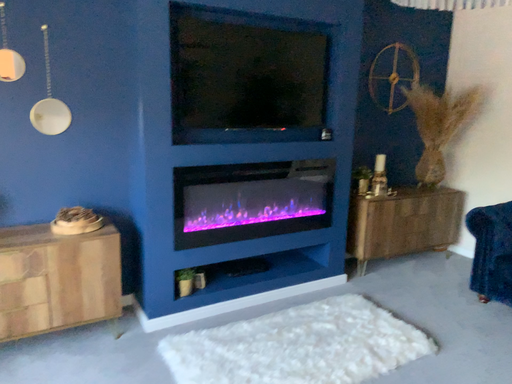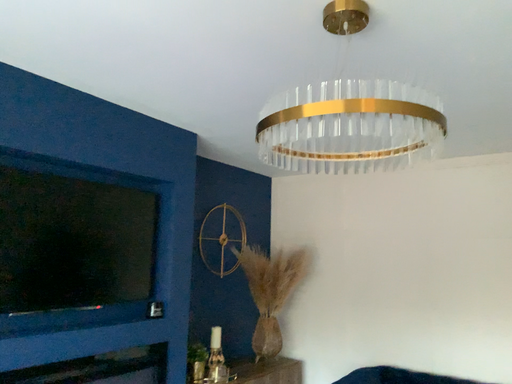
Question: How did the camera likely rotate when shooting the video?

Choices:
 (A) rotated left
 (B) rotated right

Answer: (B)